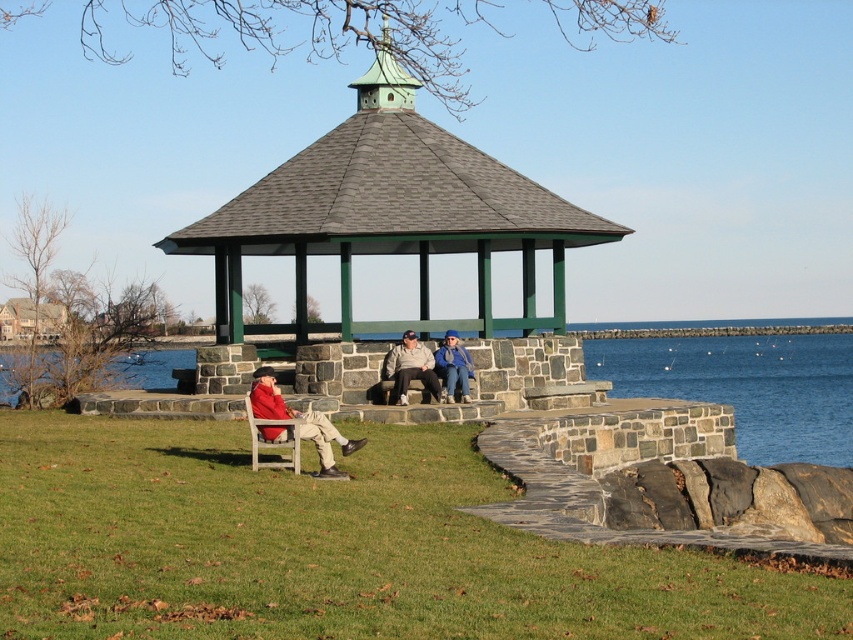
Question: Is green shingled gazebo at center above matte gray stone bench at center?

Choices:
 (A) yes
 (B) no

Answer: (A)

Question: Which point appears closest to the camera in this image?

Choices:
 (A) (572, 236)
 (B) (469, 360)
 (C) (462, 385)
 (D) (296, 410)

Answer: (D)

Question: Based on their relative distances, which object is nearer to the matte red jacket at lower left?

Choices:
 (A) green shingled gazebo at center
 (B) blue denim jacket at center
 (C) matte gray stone bench at center

Answer: (C)

Question: Which object is closer to the camera taking this photo?

Choices:
 (A) matte gray stone bench at center
 (B) matte red jacket at lower left
 (C) green shingled gazebo at center
 (D) blue denim jacket at center

Answer: (B)

Question: Does green shingled gazebo at center appear over matte gray stone bench at center?

Choices:
 (A) yes
 (B) no

Answer: (A)

Question: Does green shingled gazebo at center appear under matte gray stone bench at center?

Choices:
 (A) no
 (B) yes

Answer: (A)